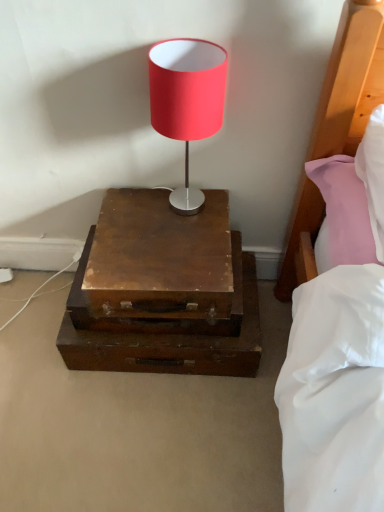
Question: Is wooden drawer at center situated inside wooden nightstand at center or outside?

Choices:
 (A) inside
 (B) outside

Answer: (B)

Question: Visually, is wooden drawer at center positioned to the left or to the right of wooden nightstand at center?

Choices:
 (A) left
 (B) right

Answer: (A)

Question: Which of these objects is positioned farthest from the wooden drawer at center?

Choices:
 (A) wooden nightstand at center
 (B) matte red lampshade at center

Answer: (B)

Question: Estimate the real-world distances between objects in this image. Which object is closer to the wooden drawer at center?

Choices:
 (A) wooden nightstand at center
 (B) matte red lampshade at center

Answer: (A)